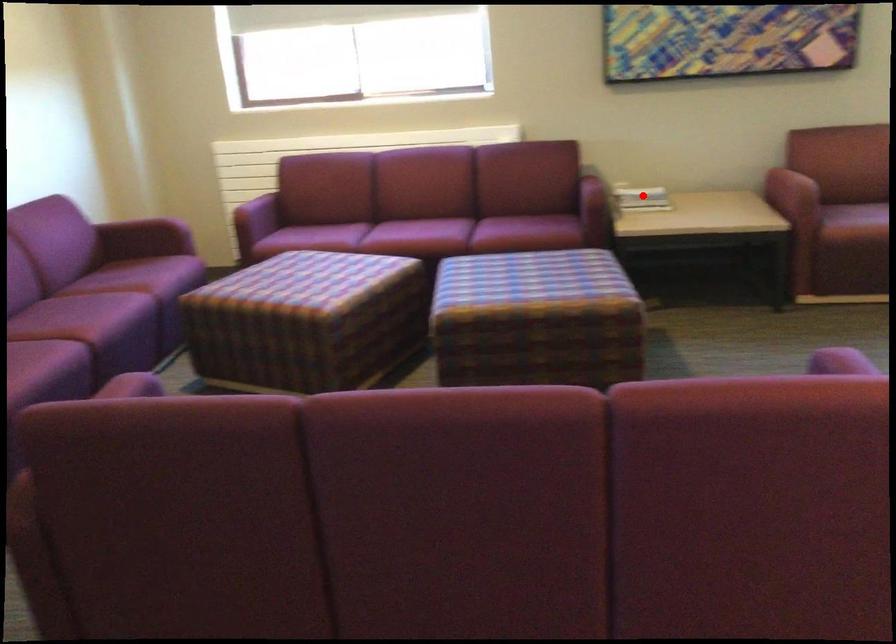
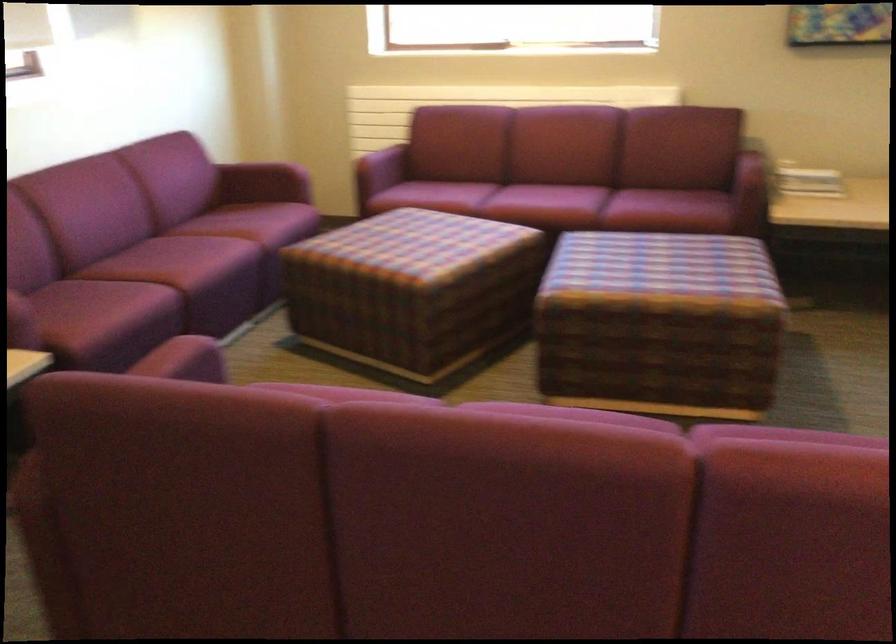
Locate, in the second image, the point that corresponds to the highlighted location in the first image.

(807, 180)